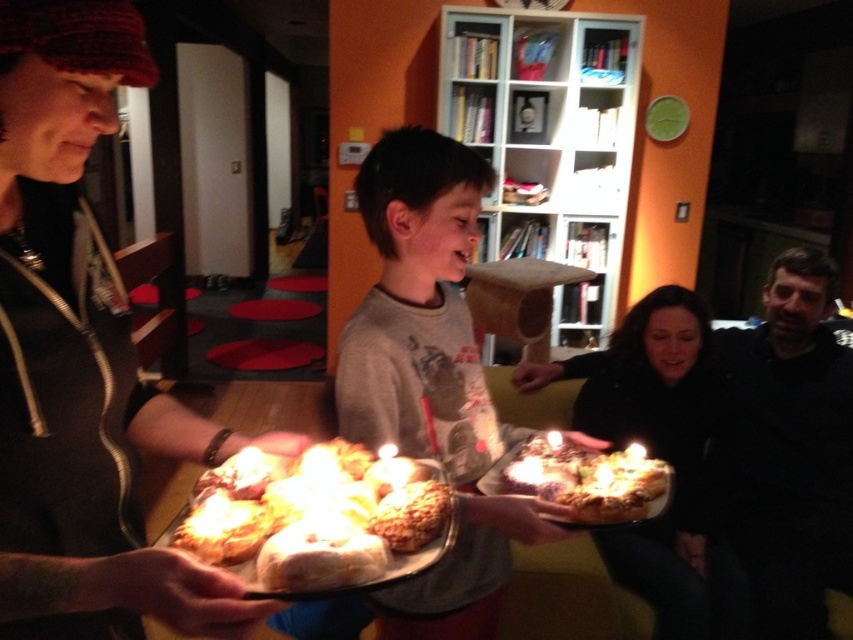
Can you confirm if gray cotton shirt at center is positioned to the right of dark gray sweater at lower right?

No, gray cotton shirt at center is not to the right of dark gray sweater at lower right.

Locate an element on the screen. The height and width of the screenshot is (640, 853). gray cotton shirt at center is located at coordinates (431, 378).

Image resolution: width=853 pixels, height=640 pixels. Find the location of `gray cotton shirt at center`. gray cotton shirt at center is located at coordinates pyautogui.click(x=431, y=378).

Does gray cotton shirt at center lie in front of golden brown crusty bread at center?

No, it is not.

Is gray cotton shirt at center behind golden brown crusty bread at center?

Yes, it is.

Find the location of a particular element. gray cotton shirt at center is located at coordinates (431, 378).

Find the location of a particular element. This screenshot has width=853, height=640. gray cotton shirt at center is located at coordinates (431, 378).

Is black matte sweater at right to the left of dark gray sweater at lower right from the viewer's perspective?

Incorrect, black matte sweater at right is not on the left side of dark gray sweater at lower right.

Is point (836, 531) less distant than point (601, 534)?

No, (836, 531) is further to viewer.

I want to click on black matte sweater at right, so click(790, 449).